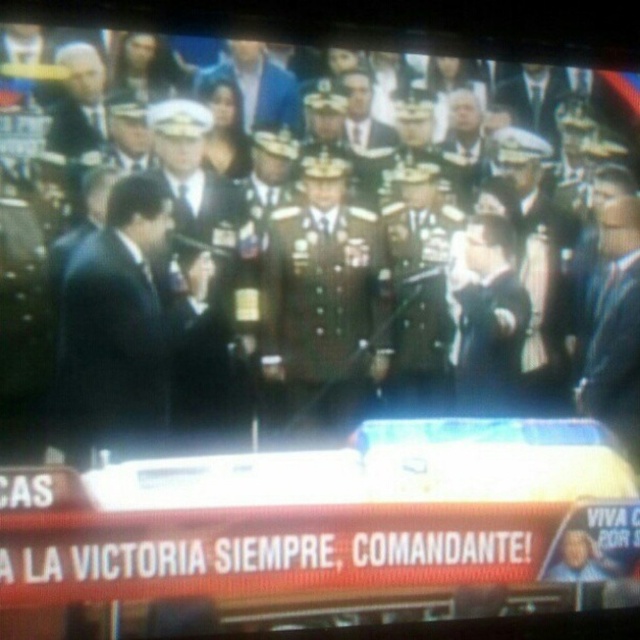
You are a photographer at the event and need to capture a photo of both the black matte suit at left and the satin blue suit at right. Considering their widths, which one should you focus on first to ensure they both fit in the frame?

The black matte suit at left is wider than the satin blue suit at right, so you should focus on the black matte suit at left first to ensure both fit in the frame.

You are a photographer standing at the back of the room. You need to take a clear photo of the black matte suit at left. Based on the distance provided, can you capture a clear photo without moving closer?

The black matte suit at left is 7.06 feet away from the camera. Since this distance is manageable for a standard camera lens, you can capture a clear photo without moving closer.